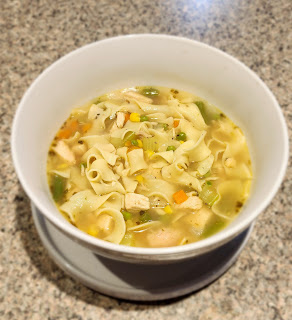
Where is `1 bowl`? The image size is (292, 320). 1 bowl is located at coordinates (219, 235).